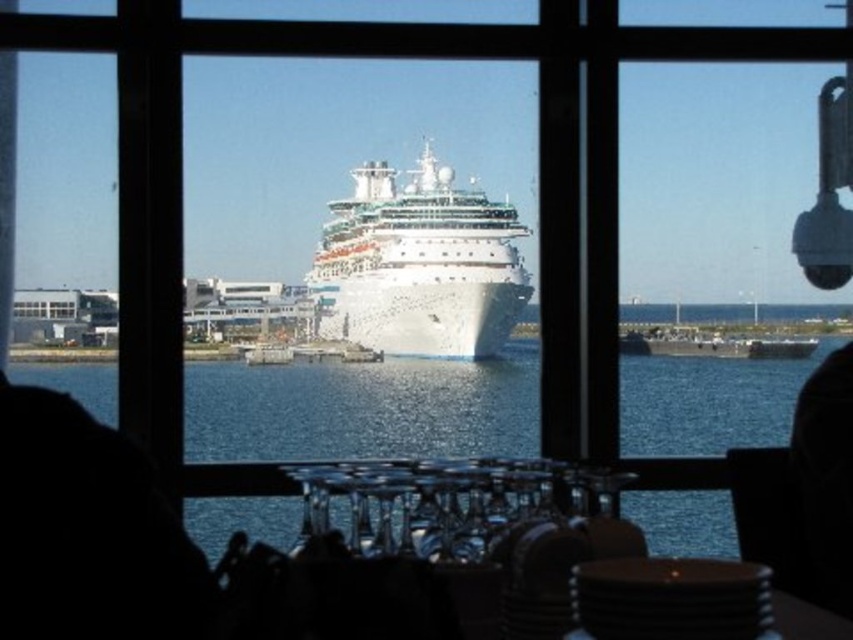
You are a guest at the restaurant looking through the window. You see the blue water at center and the white glossy cruise ship at center. Which one appears taller in the view?

The white glossy cruise ship at center appears taller than the blue water at center because the blue water at center is not as tall as the white glossy cruise ship at center.